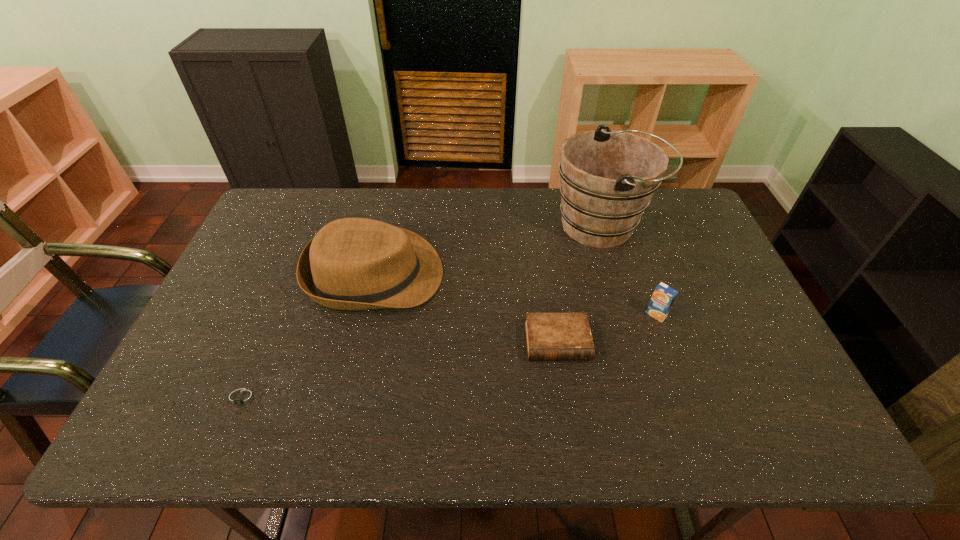
The height and width of the screenshot is (540, 960). Identify the location of bucket. (608, 177).

Where is `fedora`? fedora is located at coordinates (352, 263).

This screenshot has width=960, height=540. I want to click on orange_juice, so click(x=664, y=296).

This screenshot has height=540, width=960. Find the location of `the fourth farthest object`. the fourth farthest object is located at coordinates (549, 336).

At what (x,y) coordinates should I click in order to perform the action: click on the fourth tallest object. Please return your answer as a coordinate pair (x, y). The height and width of the screenshot is (540, 960). Looking at the image, I should click on (549, 336).

Identify the location of the shortest object. (242, 399).

You are a GUI agent. You are given a task and a screenshot of the screen. Output one action in this format:
    pyautogui.click(x=<x>, y=<y>)
    Task: Click on the nearest object
    This screenshot has height=540, width=960.
    Given the screenshot: What is the action you would take?
    pyautogui.click(x=242, y=399)

Locate an element on the screen. vacant space located on the handle side of the bucket is located at coordinates (691, 226).

Identify the location of vacant space located 0.170m on the front-facing side of the fourth shortest object. The width and height of the screenshot is (960, 540). (501, 274).

Locate an element on the screen. Image resolution: width=960 pixels, height=540 pixels. free space located on the back of the orange_juice is located at coordinates (643, 278).